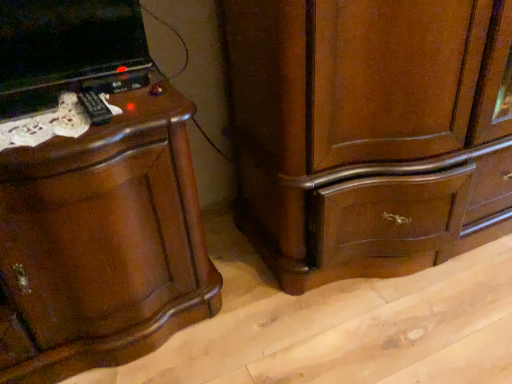
Identify the location of free location to the right of matte brown chest of drawers at left. The image size is (512, 384). (276, 307).